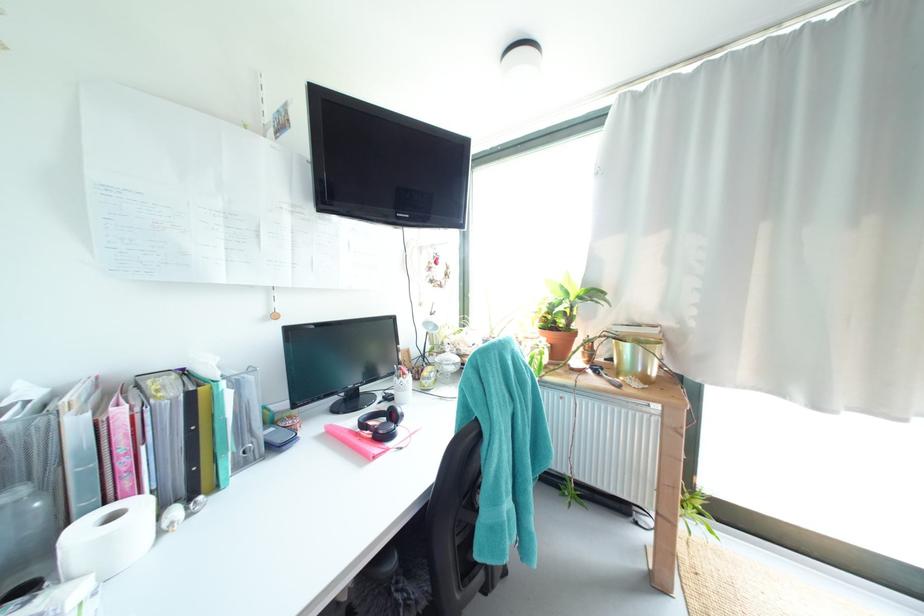
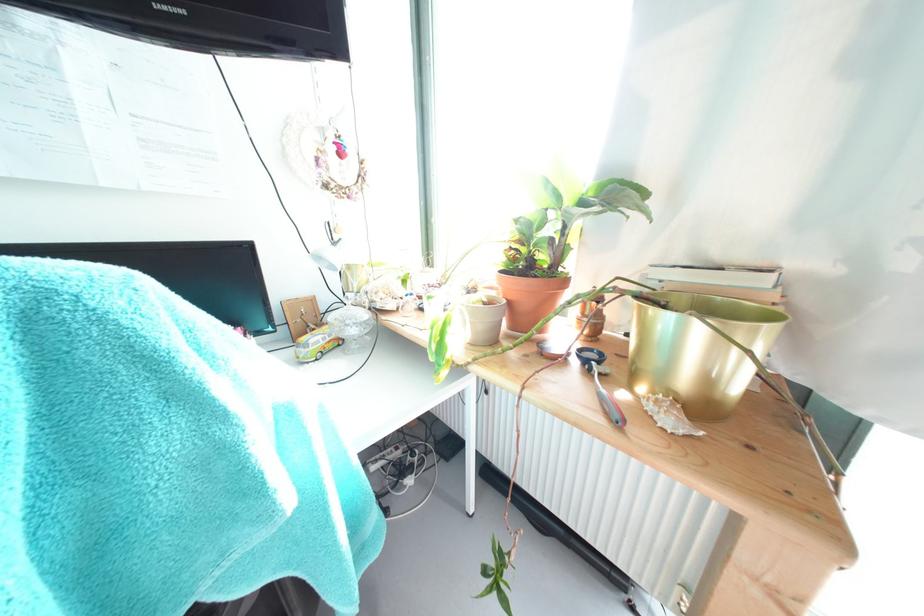
Where in the second image is the point corresponding to (635,349) from the first image?

(675, 321)